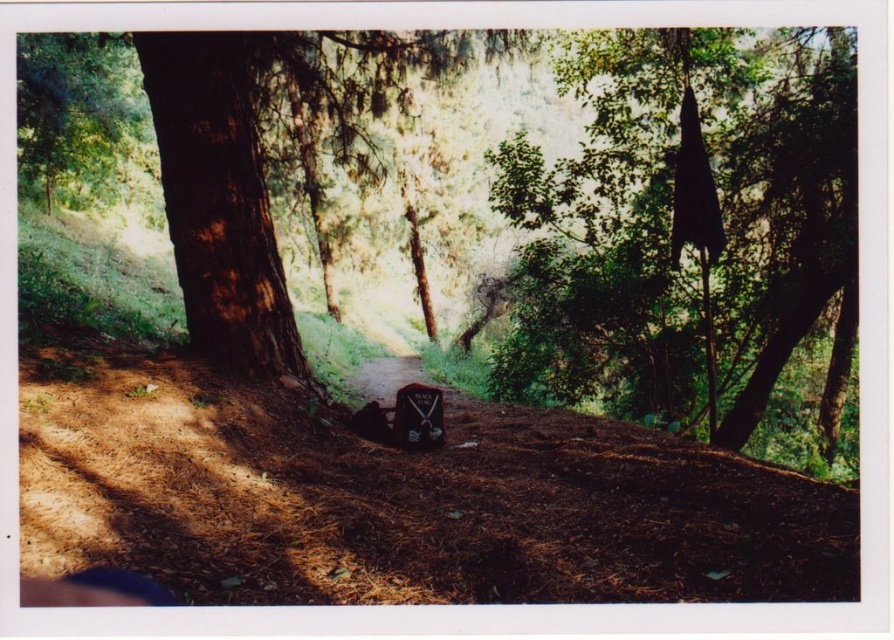
Question: Considering the real-world distances, which object is closest to the brown dirt track at lower center?

Choices:
 (A) smooth wooden sign at center
 (B) black matte umbrella at upper right

Answer: (A)

Question: Which point is farther to the camera?

Choices:
 (A) brown rough bark tree at center
 (B) black matte gravestone at center
 (C) smooth wooden sign at center

Answer: (C)

Question: Which is nearer to the black matte umbrella at upper right?

Choices:
 (A) smooth wooden sign at center
 (B) black matte gravestone at center
 (C) brown rough bark tree at center

Answer: (A)

Question: Can you confirm if brown rough bark tree at center is smaller than smooth wooden sign at center?

Choices:
 (A) yes
 (B) no

Answer: (B)

Question: In this image, where is brown dirt track at lower center located relative to black matte gravestone at center?

Choices:
 (A) below
 (B) above

Answer: (B)

Question: Does brown rough bark tree at center have a greater width compared to black matte umbrella at upper right?

Choices:
 (A) no
 (B) yes

Answer: (B)